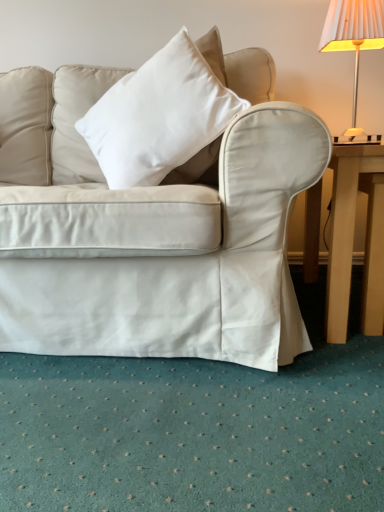
Question: From the image's perspective, is white cotton pillow at center located above or below white pleated fabric lampshade at upper right?

Choices:
 (A) below
 (B) above

Answer: (A)

Question: From a real-world perspective, is white cotton pillow at center positioned above or below white pleated fabric lampshade at upper right?

Choices:
 (A) below
 (B) above

Answer: (A)

Question: Which object is positioned farthest from the white pleated fabric lampshade at upper right?

Choices:
 (A) light brown wooden table at right
 (B) white cotton pillow at center

Answer: (B)

Question: Which object is the farthest from the light brown wooden table at right?

Choices:
 (A) white pleated fabric lampshade at upper right
 (B) white cotton pillow at center

Answer: (A)